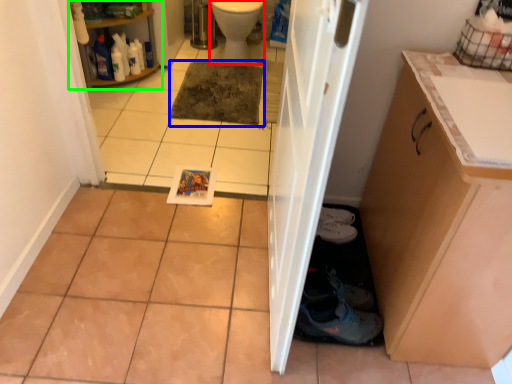
Question: Which is nearer to the toilet bowl (highlighted by a red box)? mat (highlighted by a blue box) or shelf (highlighted by a green box).

Choices:
 (A) mat
 (B) shelf

Answer: (A)